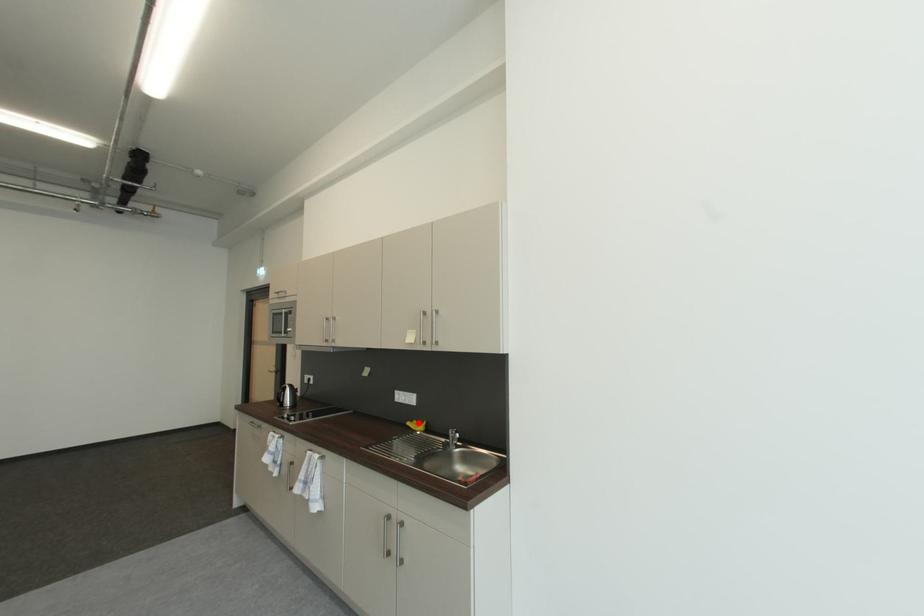
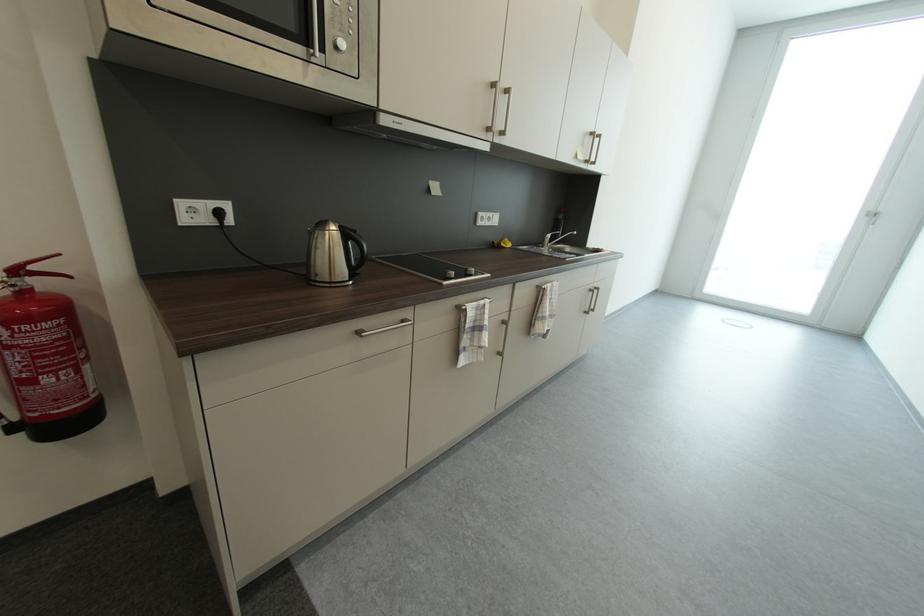
Find the pixel in the second image that matches the highlighted location in the first image.

(501, 244)